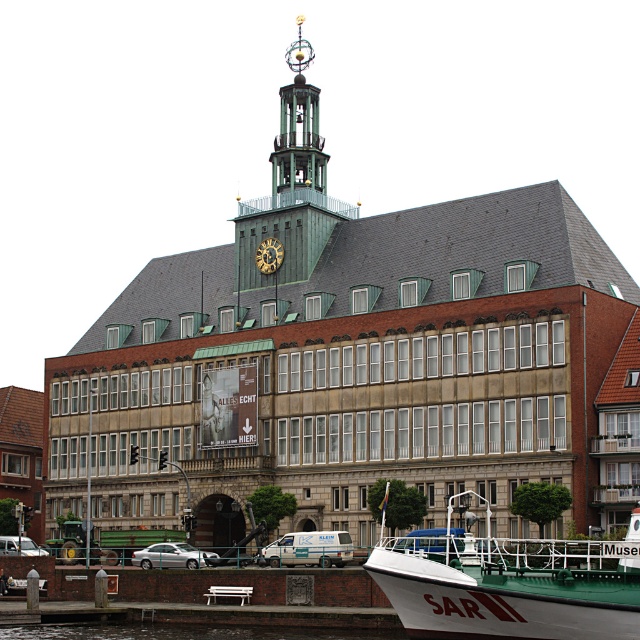
You are an architect analyzing the building design. You need to determine which object occupies more horizontal space between the green glass bell tower at upper center and the gold metallic clock at center. Based on the provided information, which one has a greater width?

The green glass bell tower at upper center has a greater width than the gold metallic clock at center according to the description.

You are standing in front of the building and notice two points marked on its facade. The first point is at coordinates point (x=280, y=131) and the second is at point (x=266, y=273). From your vantage point, which point is closer to you?

Point (x=266, y=273) is closer to you because the point (x=280, y=131) is behind it according to their positions.